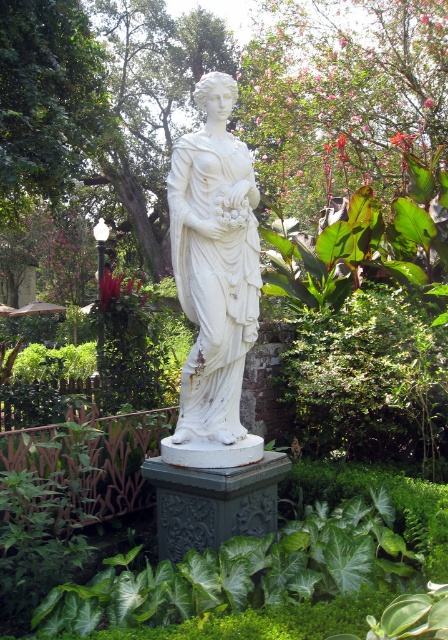
Is green leafy tree at center further to camera compared to white marble statue at center?

Yes, green leafy tree at center is behind white marble statue at center.

Between green leafy tree at center and white marble statue at center, which one has less height?

With less height is white marble statue at center.

Between point (349, 45) and point (255, 220), which one is positioned behind?

The point (349, 45) is more distant.

Where is `green leafy tree at center`? Image resolution: width=448 pixels, height=640 pixels. green leafy tree at center is located at coordinates (237, 100).